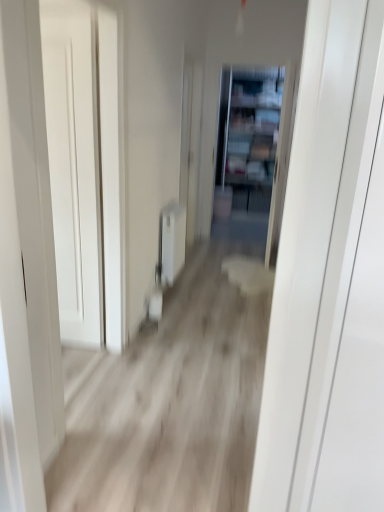
The width and height of the screenshot is (384, 512). Find the location of `wooden floor at center`. wooden floor at center is located at coordinates (169, 403).

Describe the element at coordinates (75, 172) in the screenshot. I see `white smooth door at left` at that location.

At what (x,y) coordinates should I click in order to perform the action: click on wooden floor at center. Please return your answer as a coordinate pair (x, y). The width and height of the screenshot is (384, 512). Looking at the image, I should click on (169, 403).

Which is in front, clear glass bookshelf at center or white smooth door at left?

white smooth door at left is more forward.

From a real-world perspective, which is physically above, clear glass bookshelf at center or white smooth door at left?

From a 3D spatial view, clear glass bookshelf at center is above.

Between clear glass bookshelf at center and white smooth door at left, which one appears on the left side from the viewer's perspective?

white smooth door at left.

From the image's perspective, is clear glass bookshelf at center beneath wooden floor at center?

Actually, clear glass bookshelf at center appears above wooden floor at center in the image.

Which is more to the right, clear glass bookshelf at center or wooden floor at center?

Positioned to the right is clear glass bookshelf at center.

In the image, is clear glass bookshelf at center positioned in front of or behind wooden floor at center?

In the image, clear glass bookshelf at center appears behind wooden floor at center.

Between white smooth door at left and clear glass bookshelf at center, which one has more height?

clear glass bookshelf at center is taller.

Are white smooth door at left and clear glass bookshelf at center beside each other?

There is a gap between white smooth door at left and clear glass bookshelf at center.

Which object is closer to the camera taking this photo, wooden floor at center or clear glass bookshelf at center?

wooden floor at center is more forward.

Which of these two, wooden floor at center or clear glass bookshelf at center, stands taller?

Standing taller between the two is clear glass bookshelf at center.

Is wooden floor at center at the right side of clear glass bookshelf at center?

In fact, wooden floor at center is to the left of clear glass bookshelf at center.

Measure the distance from wooden floor at center to clear glass bookshelf at center.

The distance of wooden floor at center from clear glass bookshelf at center is 3.91 meters.

Is white smooth door at left oriented away from wooden floor at center?

No.

Is white smooth door at left not close to wooden floor at center?

No, there isn't a large distance between white smooth door at left and wooden floor at center.

Where is `corridor below the white smooth door at left (from a real-world perspective)`? corridor below the white smooth door at left (from a real-world perspective) is located at coordinates (169, 403).

Would you say wooden floor at center is a long distance from white smooth door at left?

No.

Considering the sizes of objects wooden floor at center and white smooth door at left in the image provided, who is wider, wooden floor at center or white smooth door at left?

wooden floor at center.

From the image's perspective, between wooden floor at center and white smooth door at left, which one is located above?

From the image's view, white smooth door at left is above.

Can you confirm if wooden floor at center is shorter than white smooth door at left?

Yes, wooden floor at center is shorter than white smooth door at left.

There is a white smooth door at left. Where is `bookshelf above it (from a real-world perspective)`? The image size is (384, 512). bookshelf above it (from a real-world perspective) is located at coordinates (249, 135).

You are a GUI agent. You are given a task and a screenshot of the screen. Output one action in this format:
    pyautogui.click(x=<x>, y=<y>)
    Task: Click on the corridor in front of the clear glass bookshelf at center
    The height and width of the screenshot is (512, 384).
    Given the screenshot: What is the action you would take?
    pyautogui.click(x=169, y=403)

Looking at the image, which one is located further to wooden floor at center, clear glass bookshelf at center or white smooth door at left?

clear glass bookshelf at center lies further to wooden floor at center than the other object.

Estimate the real-world distances between objects in this image. Which object is further from clear glass bookshelf at center, wooden floor at center or white smooth door at left?

Based on the image, white smooth door at left appears to be further to clear glass bookshelf at center.

Considering their positions, is white smooth door at left positioned closer to clear glass bookshelf at center than wooden floor at center?

The object closer to clear glass bookshelf at center is wooden floor at center.

When comparing their distances from white smooth door at left, does clear glass bookshelf at center or wooden floor at center seem closer?

Based on the image, wooden floor at center appears to be nearer to white smooth door at left.

Considering their positions, is wooden floor at center positioned closer to white smooth door at left than clear glass bookshelf at center?

Among the two, wooden floor at center is located nearer to white smooth door at left.

Based on their spatial positions, is white smooth door at left or clear glass bookshelf at center further from wooden floor at center?

Among the two, clear glass bookshelf at center is located further to wooden floor at center.

Where is `door between wooden floor at center and clear glass bookshelf at center along the z-axis`? This screenshot has width=384, height=512. door between wooden floor at center and clear glass bookshelf at center along the z-axis is located at coordinates (75, 172).